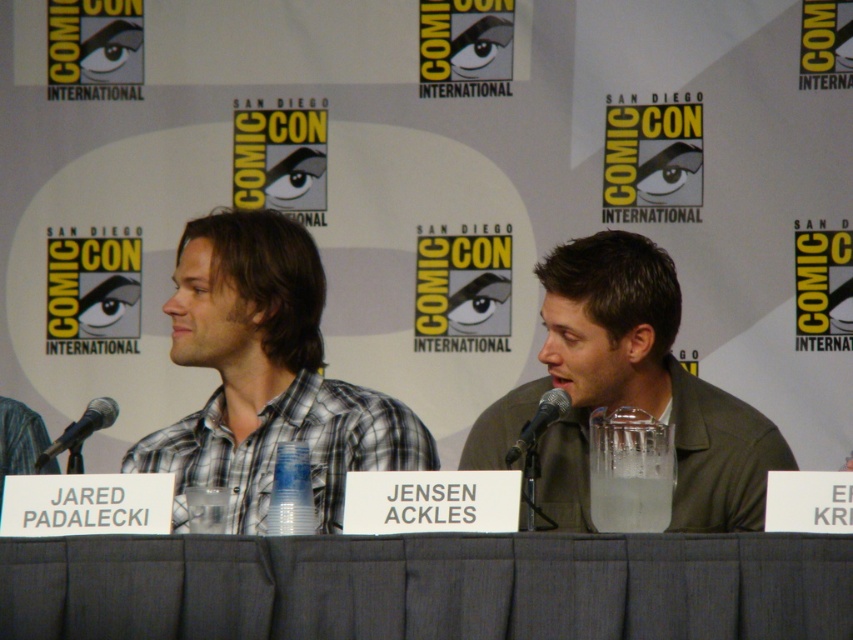
You are standing in the convention center and want to take a photo of the gray fabric table at center. If you use a camera with a 50mm lens, which is focused at 2 meters away, will the table be in focus?

The gray fabric table at center is located at point [427,586] in 2D space. Since the camera is focused at 2 meters, the table will be in focus if it is within the depth of field at that distance. However, without knowing the exact aperture and sensor size, it is impossible to definitively confirm.

You are attending Comic Con and want to take a photo of the gray fabric table at center and the green matte jacket at center. Since you can only focus on one object at a time, which one should you point your camera towards first to capture both in the frame?

The gray fabric table at center is positioned on the left side of green matte jacket at center, so you should point your camera towards the gray fabric table at center first to ensure both objects are in the frame.